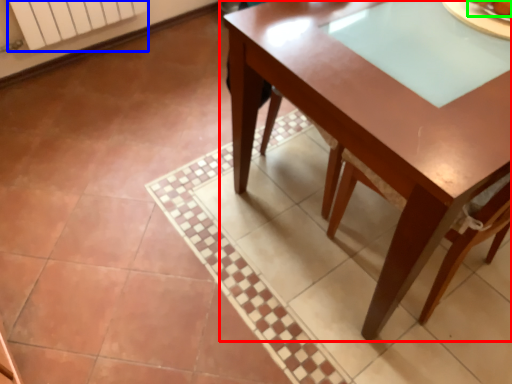
Question: Based on their relative distances, which object is nearer to table (highlighted by a red box)? Choose from radiator (highlighted by a blue box) and food (highlighted by a green box).

Choices:
 (A) radiator
 (B) food

Answer: (B)